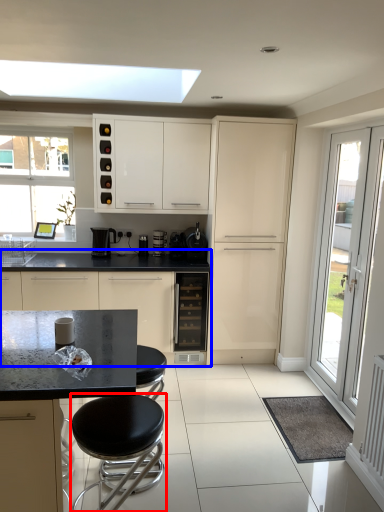
Question: Which point is further to the camera, stool (highlighted by a red box) or cabinetry (highlighted by a blue box)?

Choices:
 (A) stool
 (B) cabinetry

Answer: (B)